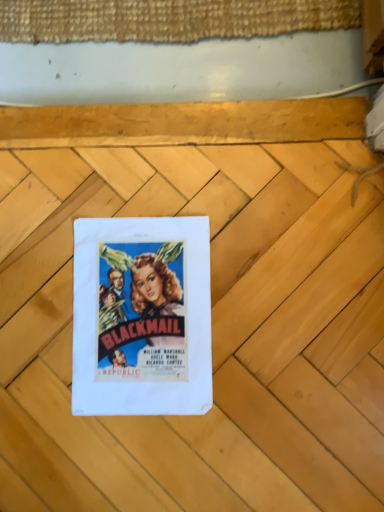
The image size is (384, 512). Describe the element at coordinates (142, 316) in the screenshot. I see `matte paper poster at center` at that location.

What is the approximate width of matte paper poster at center?

12.00 inches.

This screenshot has height=512, width=384. What are the coordinates of `matte paper poster at center` in the screenshot? It's located at (142, 316).

The width and height of the screenshot is (384, 512). Find the location of `matte paper poster at center`. matte paper poster at center is located at coordinates (142, 316).